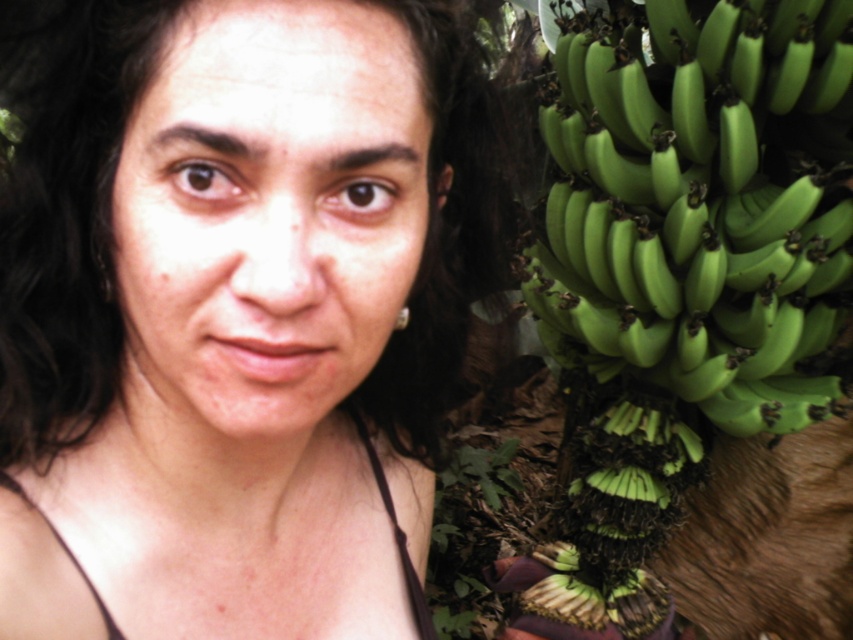
Does matte skin at center appear under green matte bananas at right?

No, matte skin at center is not below green matte bananas at right.

How distant is matte skin at center from green matte bananas at right?

They are 74.39 centimeters apart.

Between point (405, 365) and point (590, 32), which one is positioned behind?

The point (590, 32) is behind.

Identify the location of matte skin at center. (231, 308).